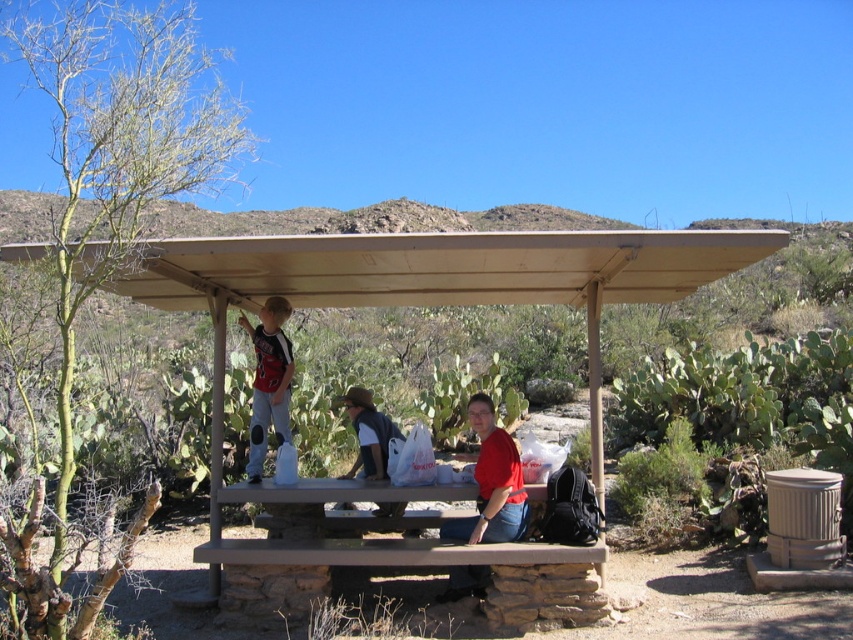
Does brown wood bus stop at center have a smaller size compared to matte red shirt at upper left?

Incorrect, brown wood bus stop at center is not smaller in size than matte red shirt at upper left.

Describe the element at coordinates (436, 280) in the screenshot. I see `brown wood bus stop at center` at that location.

What are the coordinates of `brown wood bus stop at center` in the screenshot? It's located at (436, 280).

In the scene shown: Does brown wood bus stop at center have a smaller size compared to denim jacket at lower center?

Incorrect, brown wood bus stop at center is not smaller in size than denim jacket at lower center.

Between brown wood bus stop at center and denim jacket at lower center, which one is positioned lower?

denim jacket at lower center

The height and width of the screenshot is (640, 853). Identify the location of brown wood bus stop at center. (436, 280).

Can you confirm if brown wood bus stop at center is smaller than brown wooden picnic table at center?

Incorrect, brown wood bus stop at center is not smaller in size than brown wooden picnic table at center.

Is point (366, 280) more distant than point (426, 552)?

Yes, point (366, 280) is behind point (426, 552).

Where is `brown wood bus stop at center`? This screenshot has width=853, height=640. brown wood bus stop at center is located at coordinates (436, 280).

I want to click on brown wood bus stop at center, so click(436, 280).